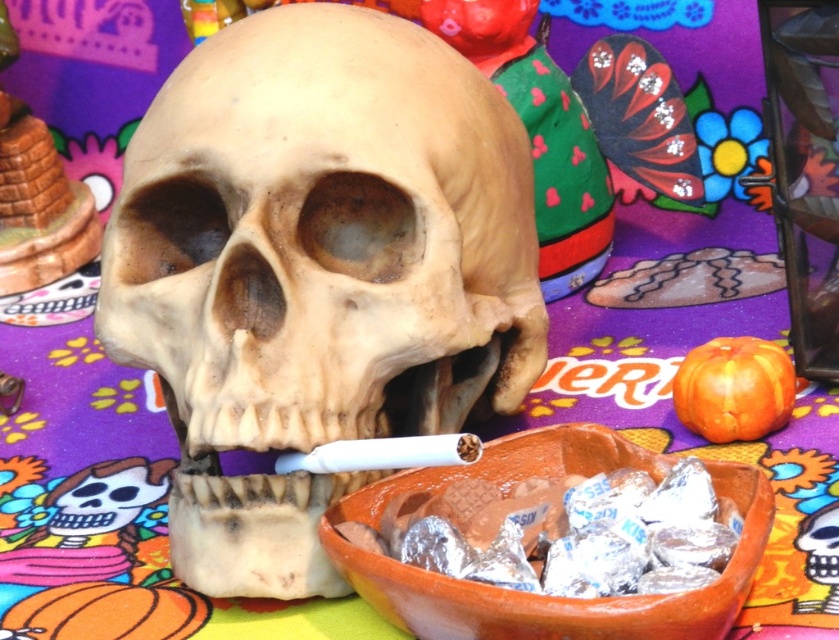
Question: Can you confirm if smooth beige skull at center is positioned to the right of orange clay bowl at center?

Choices:
 (A) no
 (B) yes

Answer: (A)

Question: Which point is closer to the camera?

Choices:
 (A) (587, 460)
 (B) (275, 442)

Answer: (B)

Question: Among these points, which one is farthest from the camera?

Choices:
 (A) (613, 456)
 (B) (214, 166)

Answer: (A)

Question: Can you confirm if smooth beige skull at center is bigger than orange clay bowl at center?

Choices:
 (A) yes
 (B) no

Answer: (A)

Question: Can you confirm if smooth beige skull at center is positioned above orange clay bowl at center?

Choices:
 (A) no
 (B) yes

Answer: (B)